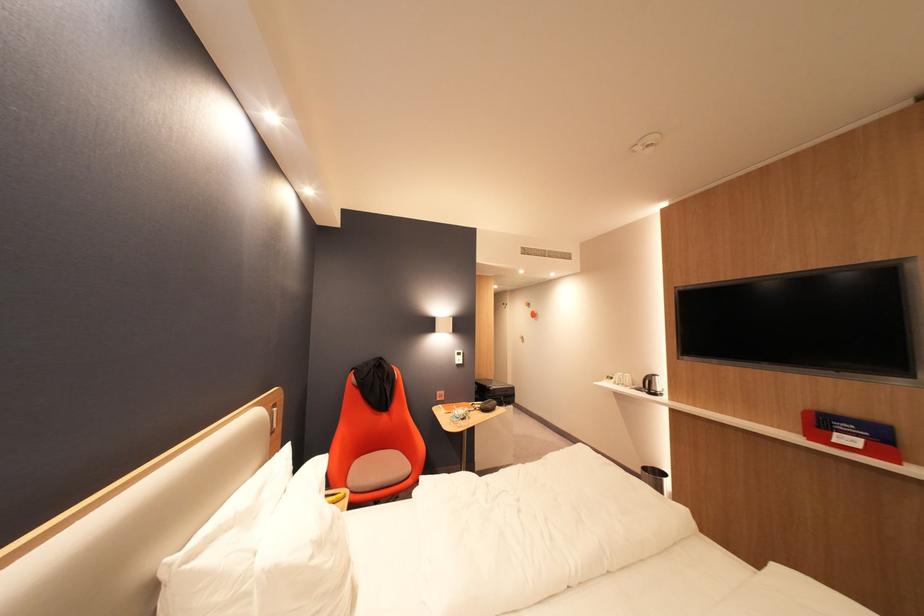
Locate an element on the screen. This screenshot has height=616, width=924. telephone handset is located at coordinates (651, 384).